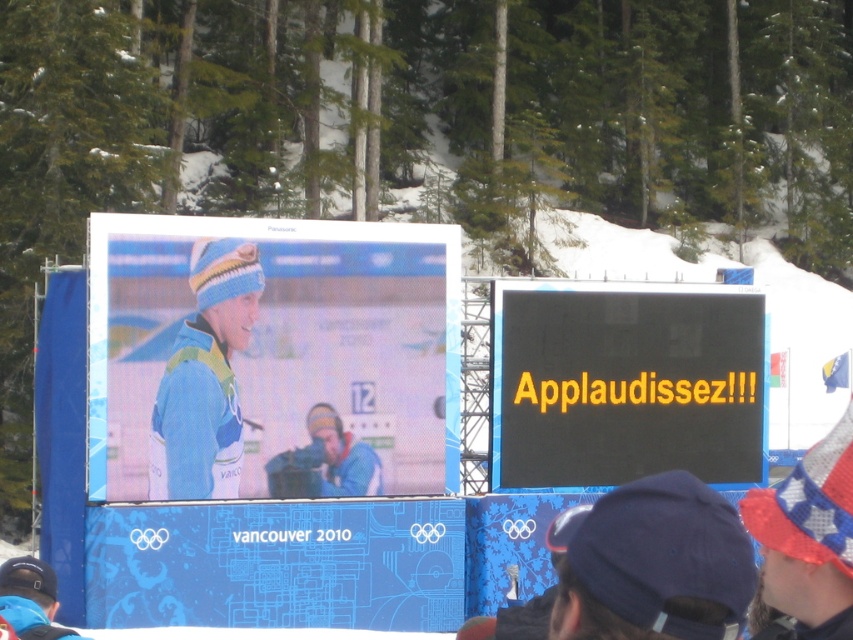
Question: Which object is closer to the camera taking this photo?

Choices:
 (A) blue fabric screen at center
 (B) blue knit hat at lower left

Answer: (B)

Question: Which object appears closest to the camera in this image?

Choices:
 (A) blue fabric screen at center
 (B) fuzzy knit hat at lower right

Answer: (B)

Question: Estimate the real-world distances between objects in this image. Which object is closer to the matte blue ski suit at center?

Choices:
 (A) blue knit hat at lower left
 (B) blue fabric cap at lower center
 (C) black matte sign at center

Answer: (C)

Question: Does matte blue ski suit at center have a smaller size compared to blue knit hat at lower left?

Choices:
 (A) no
 (B) yes

Answer: (B)

Question: Does matte blue ski suit at center have a larger size compared to blue knit hat at lower left?

Choices:
 (A) no
 (B) yes

Answer: (A)

Question: Observing the image, what is the correct spatial positioning of blue fabric screen at center in reference to fuzzy knit hat at lower right?

Choices:
 (A) below
 (B) above

Answer: (B)